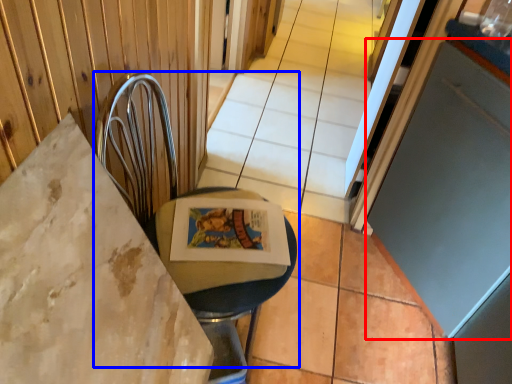
Question: Which object appears closest to the camera in this image, screen door (highlighted by a red box) or swivel chair (highlighted by a blue box)?

Choices:
 (A) screen door
 (B) swivel chair

Answer: (B)